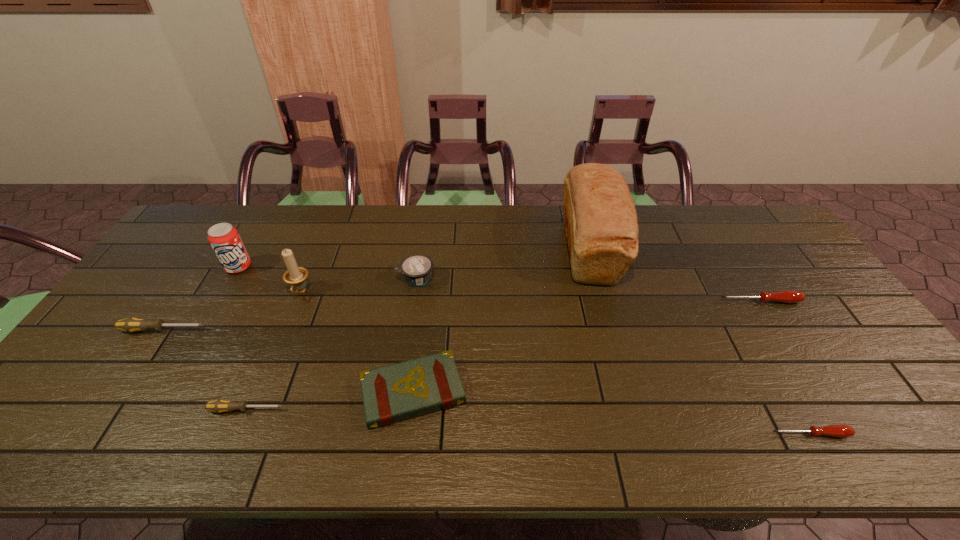
Where is `free space that satisfies the following two spatial constraints: 1. on the handle side of the farthest screwdriver; 2. on the left side of the candle_holder`? free space that satisfies the following two spatial constraints: 1. on the handle side of the farthest screwdriver; 2. on the left side of the candle_holder is located at coordinates (297, 301).

At what (x,y) coordinates should I click in order to perform the action: click on vacant space that satisfies the following two spatial constraints: 1. at the tip of the shortest screwdriver; 2. on the left side of the bigger gray screwdriver. Please return your answer as a coordinate pair (x, y). Looking at the image, I should click on (95, 434).